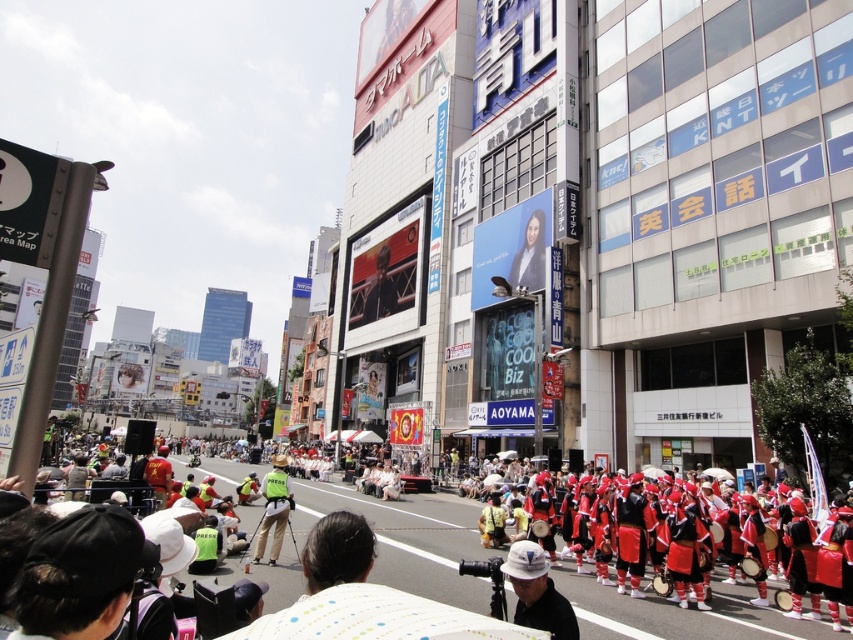
Question: Based on their relative distances, which object is nearer to the green reflective vest at center?

Choices:
 (A) white matte baseball cap at center
 (B) red fabric drum at center

Answer: (B)

Question: Among these objects, which one is nearest to the camera?

Choices:
 (A) green reflective vest at center
 (B) red fabric drum at center
 (C) white matte baseball cap at center

Answer: (C)

Question: Where is red fabric drum at center located in relation to white matte baseball cap at center in the image?

Choices:
 (A) below
 (B) above

Answer: (A)

Question: Which of the following is the closest to the observer?

Choices:
 (A) (532, 566)
 (B) (363, 500)

Answer: (A)

Question: Observing the image, what is the correct spatial positioning of red fabric drum at center in reference to white matte baseball cap at center?

Choices:
 (A) left
 (B) right

Answer: (A)

Question: Is white matte baseball cap at center above green reflective vest at center?

Choices:
 (A) no
 (B) yes

Answer: (B)